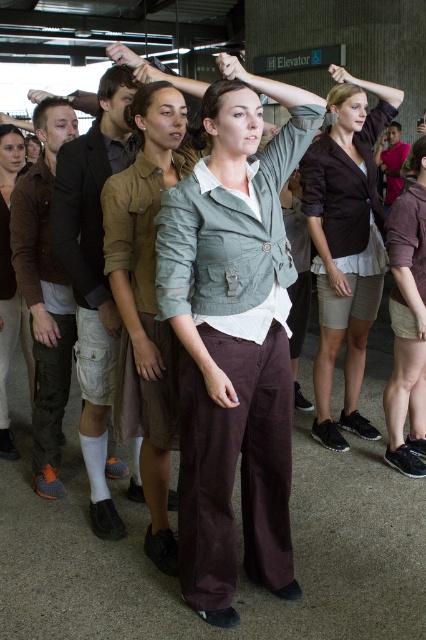
Question: Does dark brown leather jacket at center lie in front of light brown leather jacket at center?

Choices:
 (A) yes
 (B) no

Answer: (A)

Question: Which point is closer to the camera?

Choices:
 (A) (374, 436)
 (B) (23, 300)
 (C) (261, 324)
 (D) (144, 161)

Answer: (C)

Question: Which is farther from the light gray cotton shirt at center?

Choices:
 (A) matte gray jacket at center
 (B) dark brown leather jacket at center

Answer: (B)

Question: From the image, what is the correct spatial relationship of matte gray jacket at center in relation to light gray cotton shirt at center?

Choices:
 (A) below
 (B) above

Answer: (A)

Question: Estimate the real-world distances between objects in this image. Which object is closer to the matte gray jacket at center?

Choices:
 (A) dark brown leather jacket at center
 (B) light brown leather jacket at center
 (C) light gray cotton shirt at center

Answer: (C)

Question: From the image, what is the correct spatial relationship of dark brown leather jacket at center in relation to light brown leather jacket at center?

Choices:
 (A) above
 (B) below

Answer: (A)